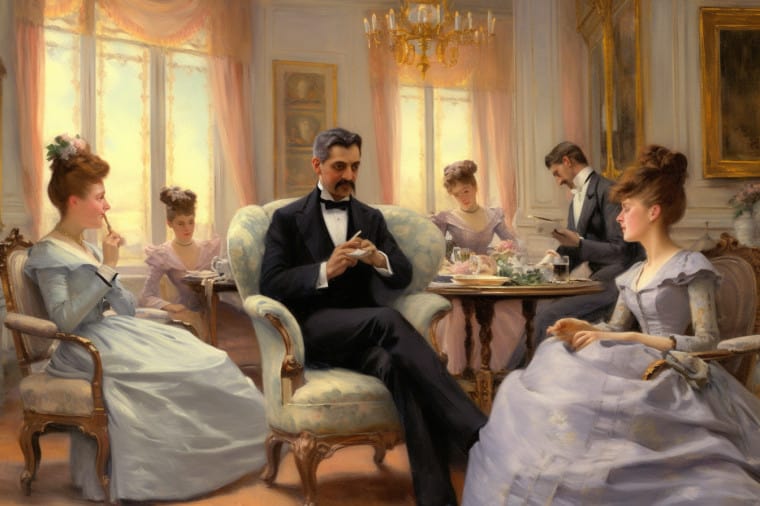
The image size is (760, 506). Find the location of `table`. table is located at coordinates pyautogui.click(x=217, y=279), pyautogui.click(x=515, y=292).